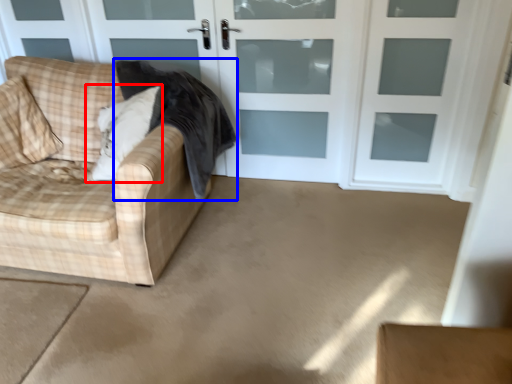
Question: Which object is further to the camera taking this photo, pillow (highlighted by a red box) or blanket (highlighted by a blue box)?

Choices:
 (A) pillow
 (B) blanket

Answer: (A)